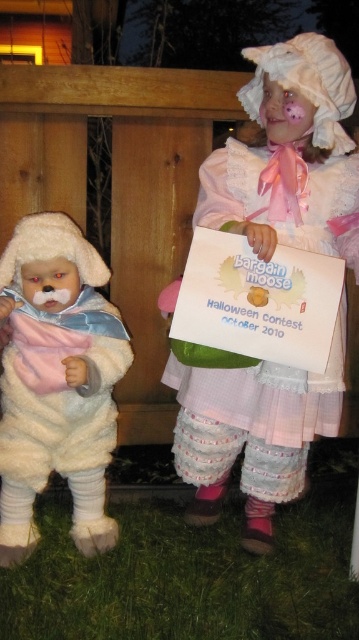
Consider the image. Can you confirm if white fluffy doll at upper center is positioned below fluffy white teddy bear at left?

Actually, white fluffy doll at upper center is above fluffy white teddy bear at left.

Is point (269, 170) closer to camera compared to point (10, 561)?

No, (269, 170) is behind (10, 561).

I want to click on white fluffy doll at upper center, so click(290, 156).